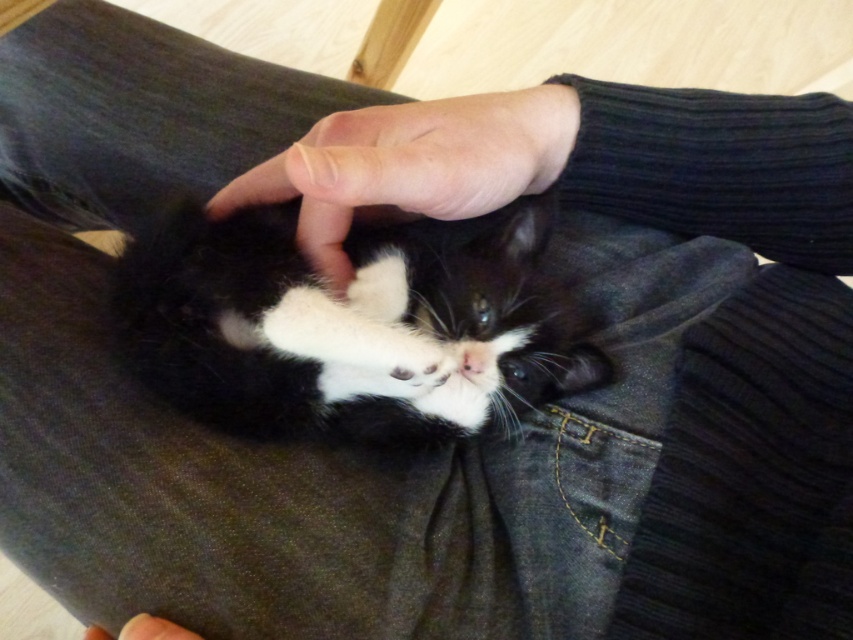
Question: Which object is the closest to the smooth skin hand at center?

Choices:
 (A) smooth skin at center
 (B) black soft fur cat at center

Answer: (B)

Question: Is smooth skin hand at center further to the viewer compared to smooth skin at center?

Choices:
 (A) no
 (B) yes

Answer: (A)

Question: Can you confirm if denim at center is positioned below smooth skin at center?

Choices:
 (A) no
 (B) yes

Answer: (A)

Question: Can you confirm if black soft fur cat at center is bigger than smooth skin hand at center?

Choices:
 (A) no
 (B) yes

Answer: (B)

Question: Which of these objects is positioned closest to the black soft fur cat at center?

Choices:
 (A) smooth skin hand at center
 (B) smooth skin at center
 (C) denim at center

Answer: (A)

Question: Which point is farther to the camera?

Choices:
 (A) denim at center
 (B) smooth skin hand at center
 (C) smooth skin at center
 (D) black soft fur cat at center

Answer: (A)